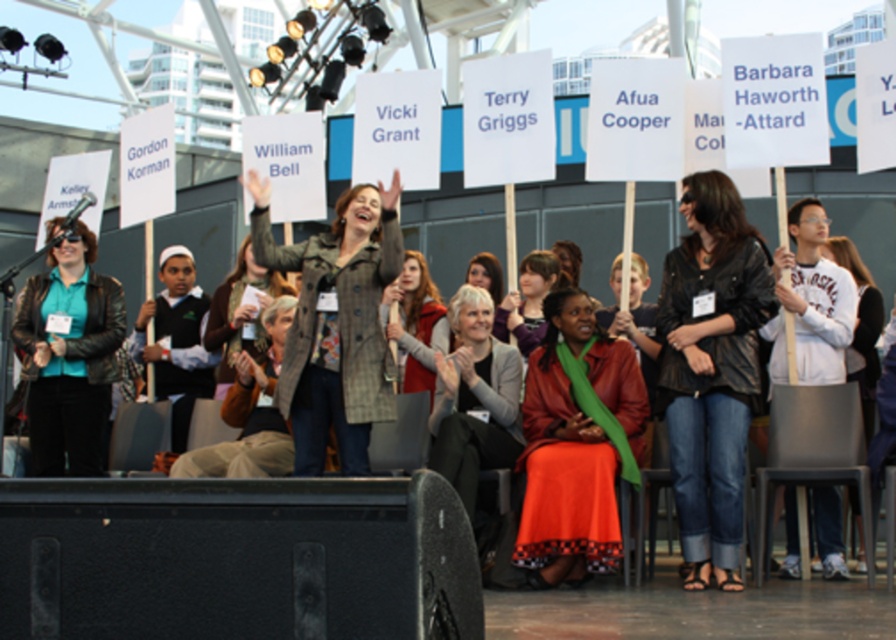
Question: Does plaid wool coat at center have a larger size compared to dark blue sweater at center?

Choices:
 (A) no
 (B) yes

Answer: (B)

Question: Which object is closer to the camera taking this photo?

Choices:
 (A) matte black jacket at left
 (B) dark blue sweater at center

Answer: (A)

Question: Is white fleece jacket at right positioned in front of matte green scarf at center?

Choices:
 (A) yes
 (B) no

Answer: (A)

Question: Considering the real-world distances, which object is closest to the leather jacket at center?

Choices:
 (A) white fleece jacket at right
 (B) matte red dress at center
 (C) matte green scarf at center
 (D) white fleece sweatshirt at right

Answer: (B)

Question: Which point is closer to the camera?

Choices:
 (A) plaid wool coat at center
 (B) dark blue sweater at center
 (C) matte red dress at center

Answer: (C)

Question: From the image, what is the correct spatial relationship of plaid wool coat at center in relation to matte gray coat at center?

Choices:
 (A) right
 (B) left

Answer: (A)